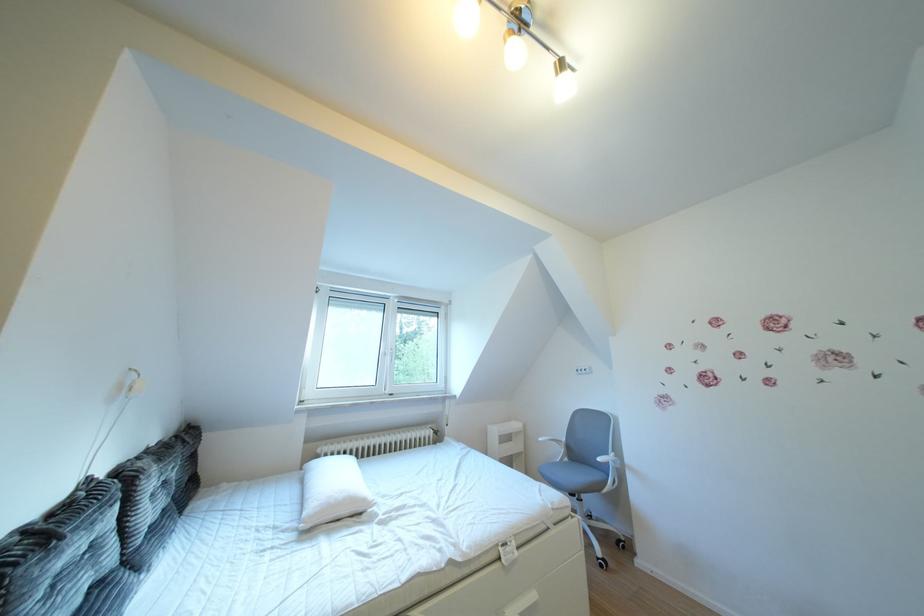
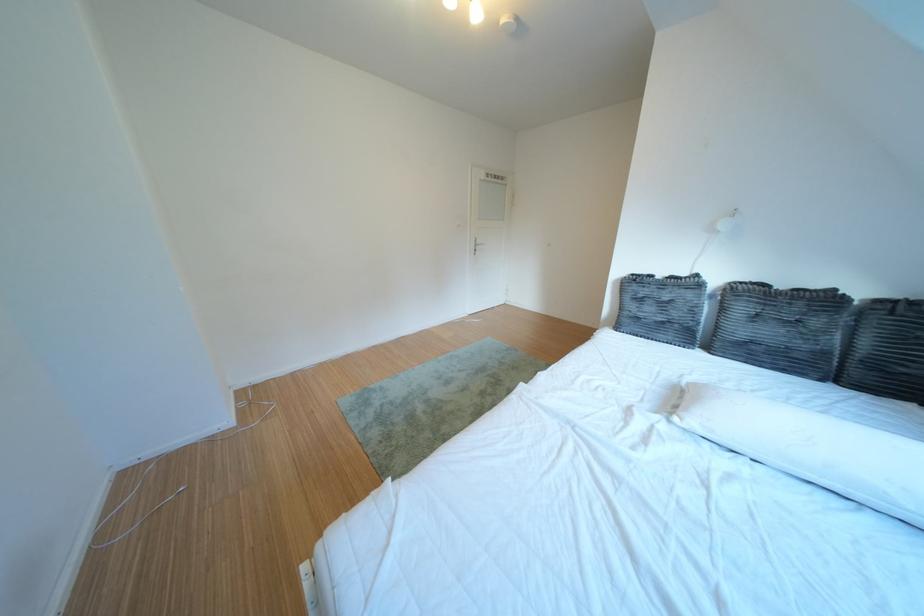
Locate, in the second image, the point that corresponds to point 190,443 in the first image.

(910, 306)